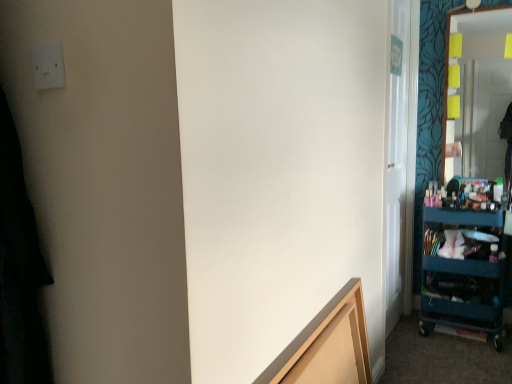
Question: Does white plastic electric outlet at upper left appear on the left side of light brown wood frame at lower center?

Choices:
 (A) no
 (B) yes

Answer: (B)

Question: Can you confirm if white plastic electric outlet at upper left is wider than light brown wood frame at lower center?

Choices:
 (A) yes
 (B) no

Answer: (B)

Question: Can light brown wood frame at lower center be found inside white plastic electric outlet at upper left?

Choices:
 (A) yes
 (B) no

Answer: (B)

Question: Would you say white plastic electric outlet at upper left is outside light brown wood frame at lower center?

Choices:
 (A) yes
 (B) no

Answer: (A)

Question: Is white plastic electric outlet at upper left shorter than light brown wood frame at lower center?

Choices:
 (A) yes
 (B) no

Answer: (A)

Question: Does white plastic electric outlet at upper left come in front of light brown wood frame at lower center?

Choices:
 (A) yes
 (B) no

Answer: (A)

Question: From a real-world perspective, is light brown wood frame at lower center over teal plastic cart at right?

Choices:
 (A) yes
 (B) no

Answer: (A)

Question: From the image's perspective, is light brown wood frame at lower center under teal plastic cart at right?

Choices:
 (A) no
 (B) yes

Answer: (B)

Question: Considering the relative sizes of light brown wood frame at lower center and teal plastic cart at right in the image provided, is light brown wood frame at lower center taller than teal plastic cart at right?

Choices:
 (A) yes
 (B) no

Answer: (B)

Question: Is light brown wood frame at lower center behind teal plastic cart at right?

Choices:
 (A) no
 (B) yes

Answer: (A)

Question: Does light brown wood frame at lower center appear on the right side of teal plastic cart at right?

Choices:
 (A) yes
 (B) no

Answer: (B)

Question: Is light brown wood frame at lower center next to teal plastic cart at right and touching it?

Choices:
 (A) yes
 (B) no

Answer: (B)

Question: Is teal plastic cart at right directly adjacent to light brown wood frame at lower center?

Choices:
 (A) no
 (B) yes

Answer: (A)